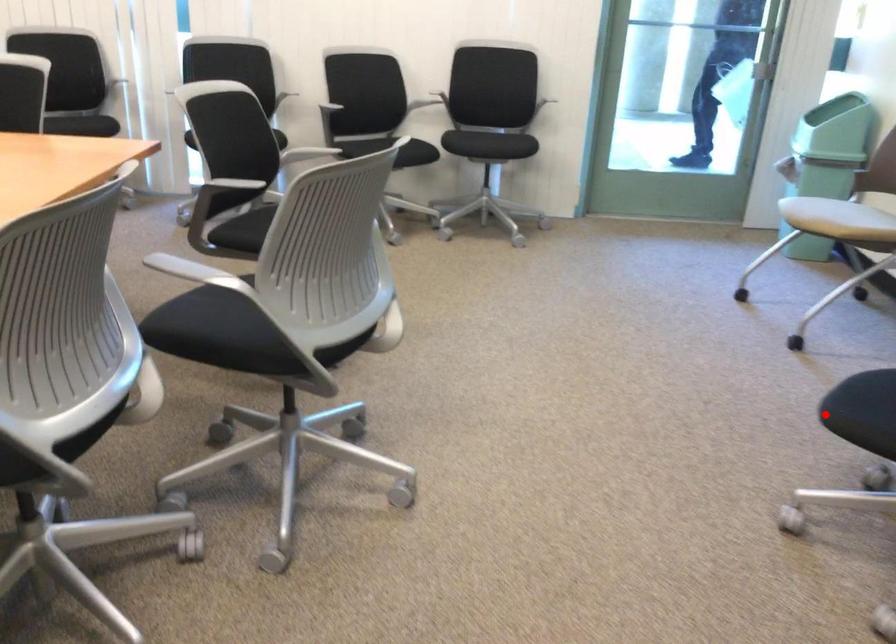
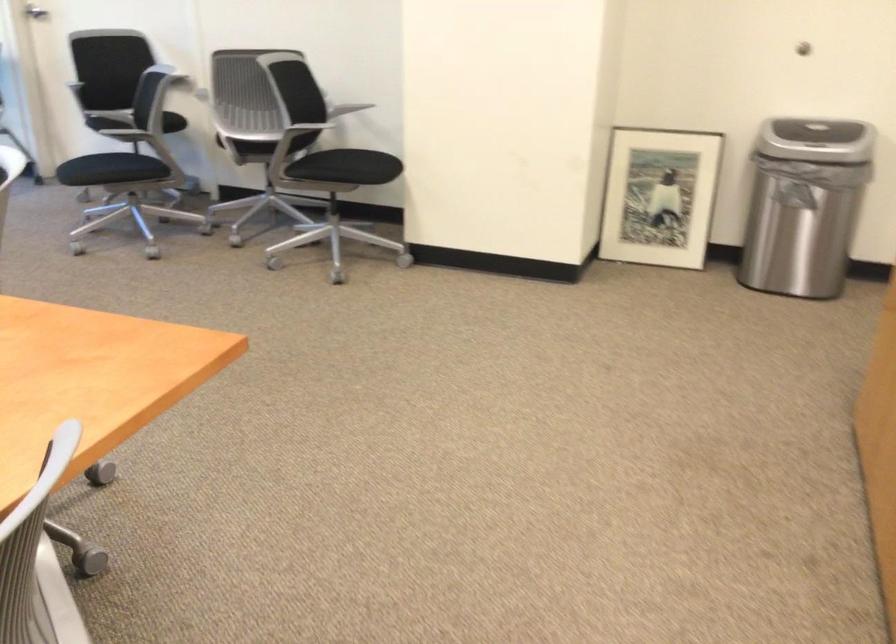
Question: I am providing you with two images of the same scene from different viewpoints. A red point is shown in image1. For the corresponding object point in image2, is it positioned nearer or farther from the camera?

Choices:
 (A) Nearer
 (B) Farther

Answer: (B)